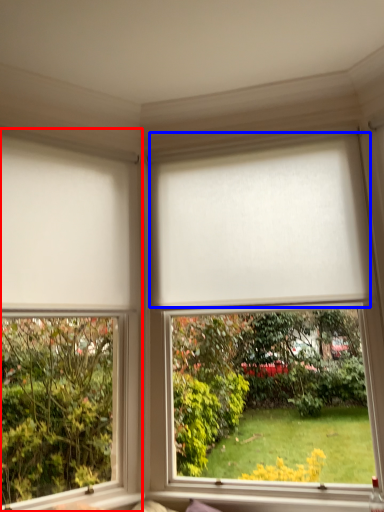
Question: Which object appears farthest to the camera in this image, window (highlighted by a red box) or blind (highlighted by a blue box)?

Choices:
 (A) window
 (B) blind

Answer: (B)